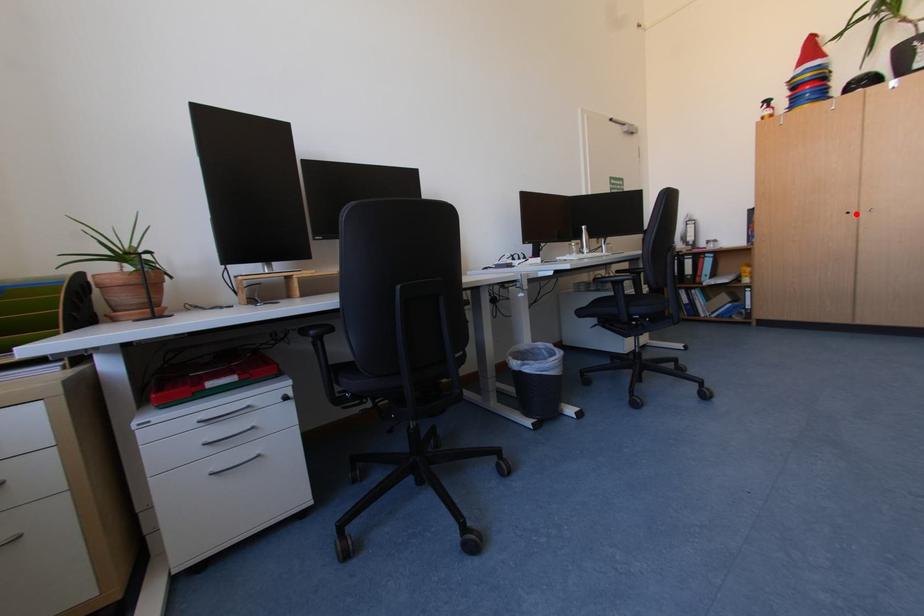
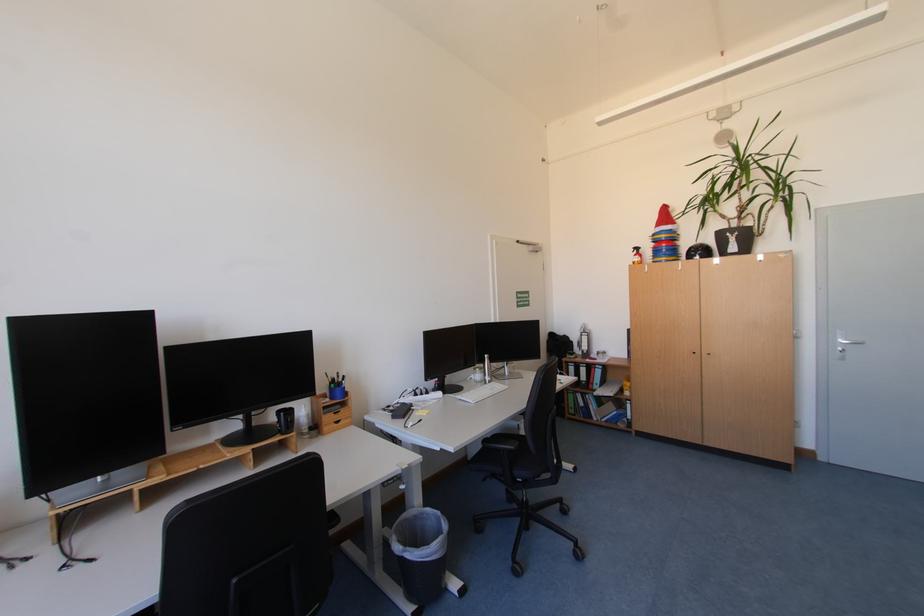
Question: I am providing you with two images of the same scene from different viewpoints. In image1, a red point is highlighted. Considering the same 3D point in image2, which of the following is correct?

Choices:
 (A) It is closer
 (B) It is farther

Answer: (A)